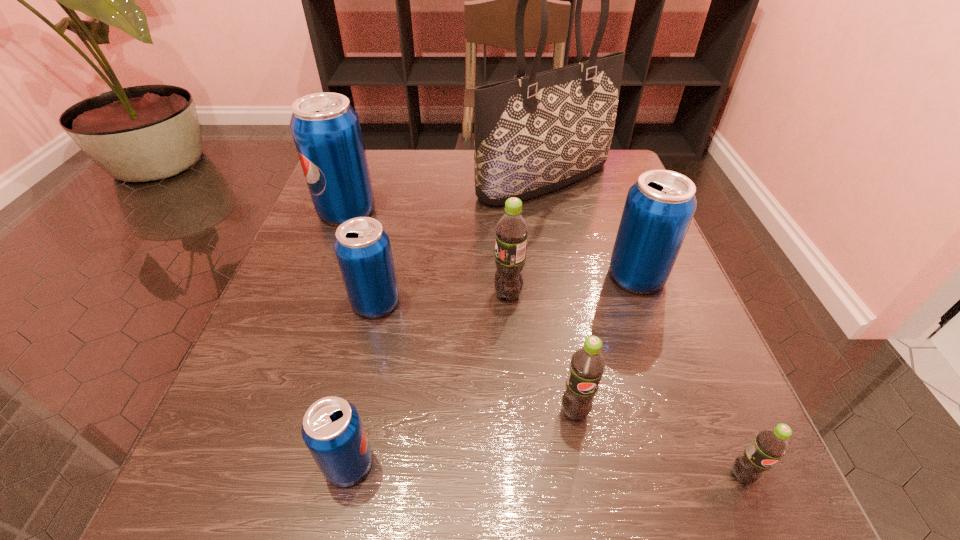
Locate an element on the screen. free space between the fifth farthest soda and the smallest blue pop soda is located at coordinates (462, 438).

Locate an element on the screen. Image resolution: width=960 pixels, height=540 pixels. free area in between the tote bag and the sixth farthest object is located at coordinates (560, 295).

Find the location of a particular element. The width and height of the screenshot is (960, 540). free space between the farthest green soda and the third smallest blue pop soda is located at coordinates (572, 285).

Image resolution: width=960 pixels, height=540 pixels. In order to click on free point between the smallest green soda and the second smallest blue pop soda in this screenshot , I will do `click(559, 389)`.

Select which object appears as the seventh closest to the third biggest blue pop soda. Please provide its 2D coordinates. Your answer should be formatted as a tuple, i.e. [(x, y)], where the tuple contains the x and y coordinates of a point satisfying the conditions above.

[(769, 445)]

Identify which object is located as the third nearest to the tallest soda. Please provide its 2D coordinates. Your answer should be formatted as a tuple, i.e. [(x, y)], where the tuple contains the x and y coordinates of a point satisfying the conditions above.

[(512, 231)]

You are a GUI agent. You are given a task and a screenshot of the screen. Output one action in this format:
    pyautogui.click(x=<x>, y=<y>)
    Task: Click on the soda that is the third closest to the third smallest blue pop soda
    The height and width of the screenshot is (540, 960).
    Given the screenshot: What is the action you would take?
    pyautogui.click(x=769, y=445)

The image size is (960, 540). Identify the location of soda identified as the sixth closest to the second nearest green soda. (326, 130).

Locate an element on the screen. The width and height of the screenshot is (960, 540). blue pop soda that is the third nearest to the second biggest blue pop soda is located at coordinates point(326,130).

Identify the location of blue pop soda that stands as the closest to the farthest green soda. This screenshot has height=540, width=960. (659, 207).